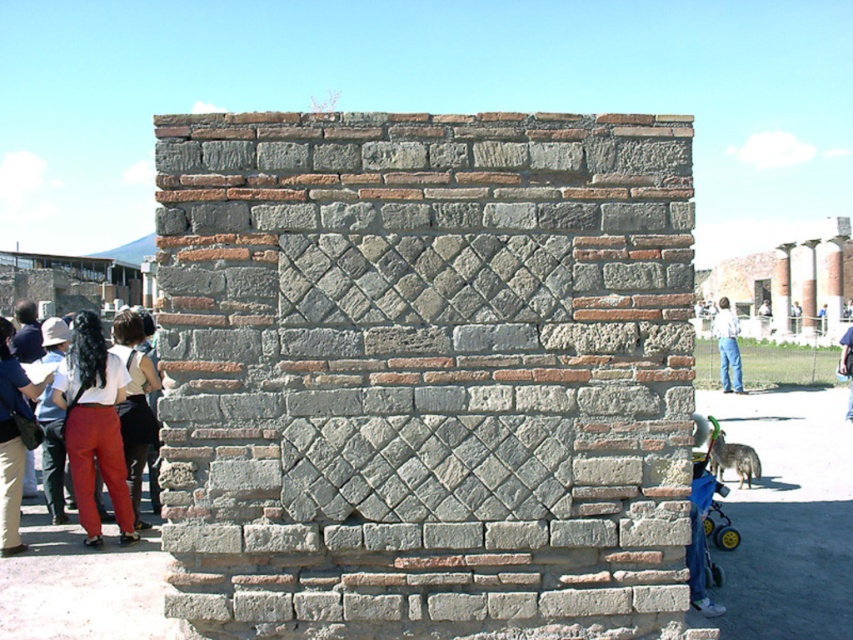
What do you see at coordinates (135, 403) in the screenshot?
I see `matte black hair at left` at bounding box center [135, 403].

Based on the photo, which is above, matte black hair at left or jeans at right?

jeans at right

The height and width of the screenshot is (640, 853). Find the location of `matte black hair at left`. matte black hair at left is located at coordinates (135, 403).

Between matte black shirt at left and blue fabric stroller at lower right, which one appears on the left side from the viewer's perspective?

Positioned to the left is matte black shirt at left.

From the picture: Does matte black shirt at left appear over blue fabric stroller at lower right?

Correct, matte black shirt at left is located above blue fabric stroller at lower right.

Describe the element at coordinates (12, 440) in the screenshot. I see `matte black shirt at left` at that location.

Find the location of a particular element. Image resolution: width=853 pixels, height=640 pixels. matte black shirt at left is located at coordinates (12, 440).

Is matte black hair at left positioned at the back of blue fabric stroller at lower right?

Yes.

Find the location of `matte black hair at left`. matte black hair at left is located at coordinates (135, 403).

Where is `matte black hair at left`? The width and height of the screenshot is (853, 640). matte black hair at left is located at coordinates (135, 403).